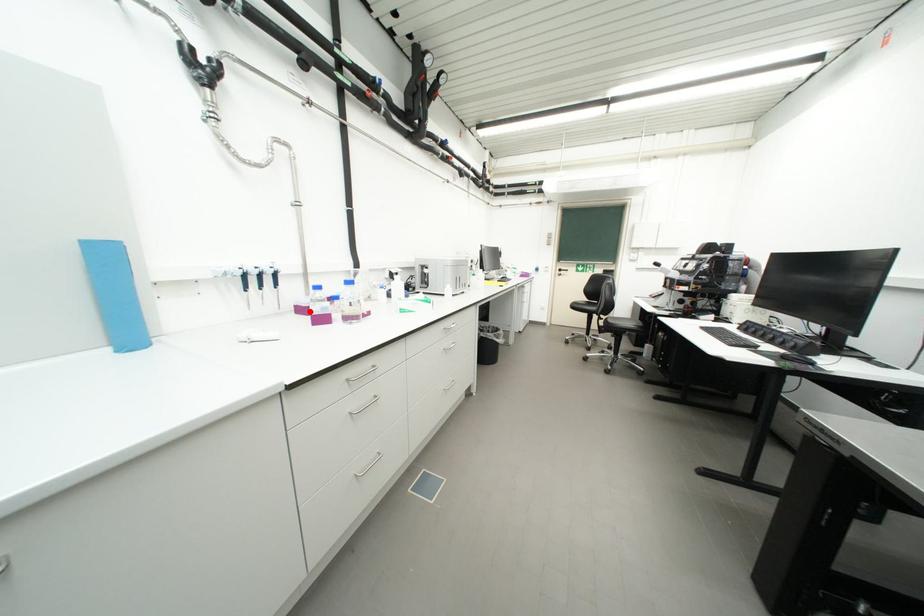
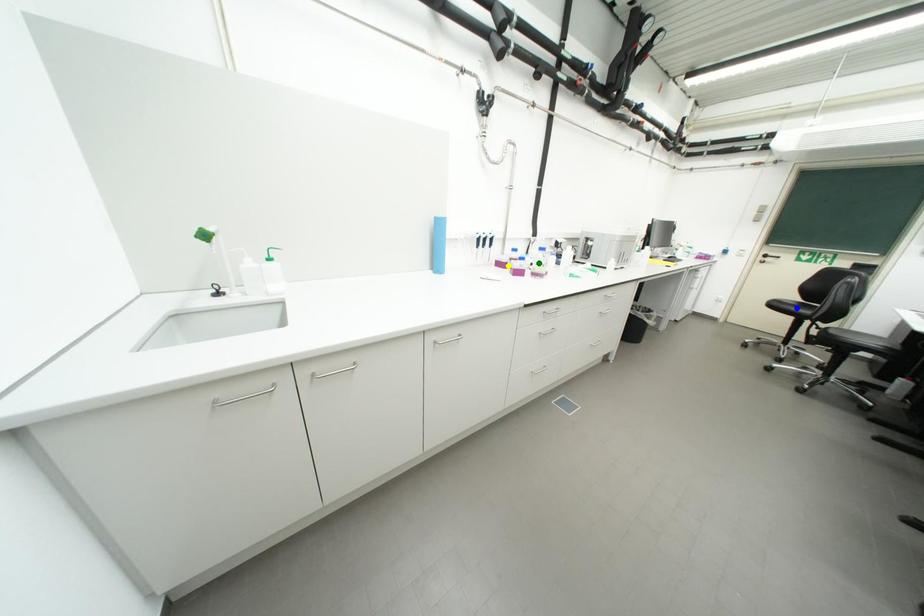
Question: I am providing you with two images of the same scene from different viewpoints. A red point is marked on the first image. You are given multiple points on the second image. Which mark in image 2 goes with the point in image 1?

Choices:
 (A) yellow point
 (B) green point
 (C) blue point

Answer: (A)